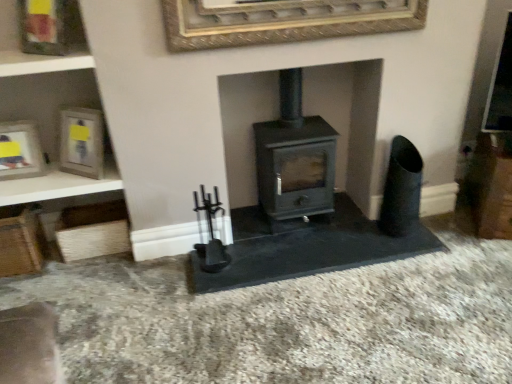
Question: From a real-world perspective, relative to matte gray wood burning stove at center, is wooden frame at upper left, the third picture frame when ordered from right to left, vertically above or below?

Choices:
 (A) above
 (B) below

Answer: (A)

Question: From the image's perspective, is wooden frame at upper left, the 2th picture frame from the left, located above or below matte gray wood burning stove at center?

Choices:
 (A) above
 (B) below

Answer: (A)

Question: Considering the real-world distances, which object is closest to the wooden frame at upper left, the third picture frame when ordered from right to left?

Choices:
 (A) wooden shelf at upper left
 (B) matte gray wood burning stove at center
 (C) matte silver picture frame at left, arranged as the 1th picture frame when viewed from the left
 (D) gold textured picture frame at upper center, acting as the first picture frame starting from the right
 (E) matte silver picture frame at upper left, which appears as the third picture frame when viewed from the left

Answer: (A)

Question: Estimate the real-world distances between objects in this image. Which object is farther from the wooden frame at upper left, the 2th picture frame from the left?

Choices:
 (A) matte gray wood burning stove at center
 (B) gold textured picture frame at upper center, acting as the first picture frame starting from the right
 (C) matte silver picture frame at upper left, the second picture frame from the right
 (D) wooden shelf at upper left
 (E) matte silver picture frame at left, placed as the fourth picture frame when sorted from right to left

Answer: (A)